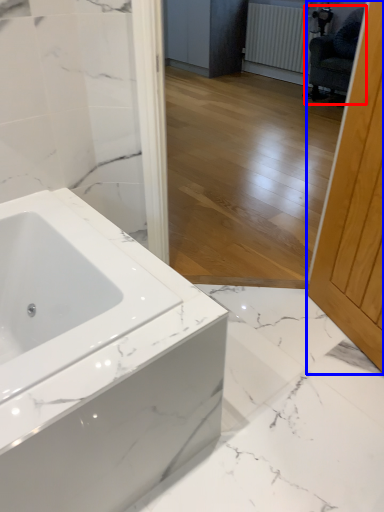
Question: Among these objects, which one is farthest to the camera, swivel chair (highlighted by a red box) or screen door (highlighted by a blue box)?

Choices:
 (A) swivel chair
 (B) screen door

Answer: (A)